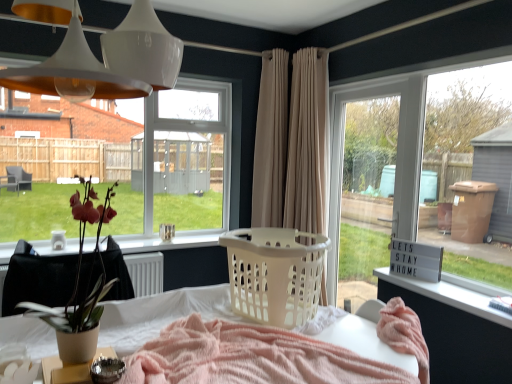
Question: Is clear glass window at upper left bigger than white plastic door at center?

Choices:
 (A) yes
 (B) no

Answer: (A)

Question: Does clear glass window at upper left have a smaller size compared to white plastic door at center?

Choices:
 (A) yes
 (B) no

Answer: (B)

Question: From the image's perspective, does clear glass window at upper left appear higher than white plastic door at center?

Choices:
 (A) yes
 (B) no

Answer: (A)

Question: From a real-world perspective, is clear glass window at upper left over white plastic door at center?

Choices:
 (A) yes
 (B) no

Answer: (A)

Question: Is clear glass window at upper left taller than white plastic door at center?

Choices:
 (A) no
 (B) yes

Answer: (A)

Question: Is clear glass window at upper left wider than white plastic door at center?

Choices:
 (A) no
 (B) yes

Answer: (B)

Question: From the image's perspective, does white plastic table at lower center appear lower than beige fabric curtain at center, which is counted as the first curtain, starting from the right?

Choices:
 (A) yes
 (B) no

Answer: (A)

Question: Is white plastic table at lower center facing towards beige fabric curtain at center, the 2th curtain from the left?

Choices:
 (A) yes
 (B) no

Answer: (B)

Question: Is white plastic table at lower center turned away from beige fabric curtain at center, the 2th curtain from the left?

Choices:
 (A) yes
 (B) no

Answer: (B)

Question: Can you confirm if white plastic table at lower center is wider than beige fabric curtain at center, the 2th curtain from the left?

Choices:
 (A) yes
 (B) no

Answer: (A)

Question: Is white plastic table at lower center placed right next to beige fabric curtain at center, the 2th curtain from the left?

Choices:
 (A) yes
 (B) no

Answer: (B)

Question: Is the position of white plastic table at lower center less distant than that of beige fabric curtain at center, the 2th curtain from the left?

Choices:
 (A) yes
 (B) no

Answer: (A)

Question: Considering the relative positions of clear glass window at upper left and matte brown pot at left in the image provided, is clear glass window at upper left behind matte brown pot at left?

Choices:
 (A) no
 (B) yes

Answer: (B)